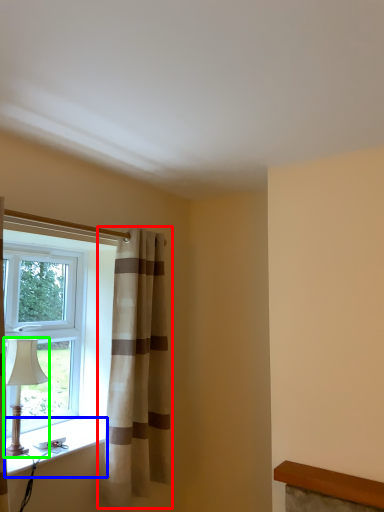
Question: Which is farther away from curtain (highlighted by a red box)? window sill (highlighted by a blue box) or table lamp (highlighted by a green box)?

Choices:
 (A) window sill
 (B) table lamp

Answer: (B)